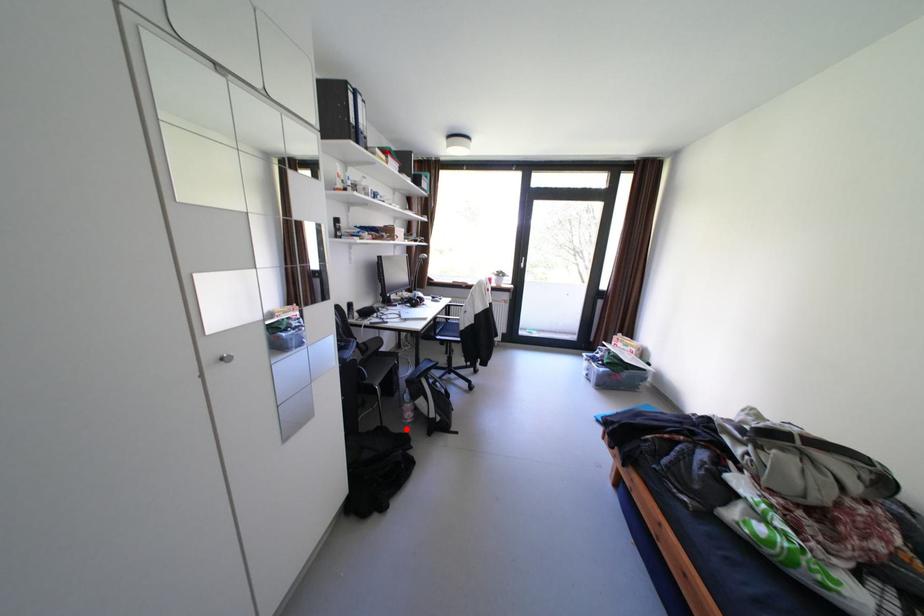
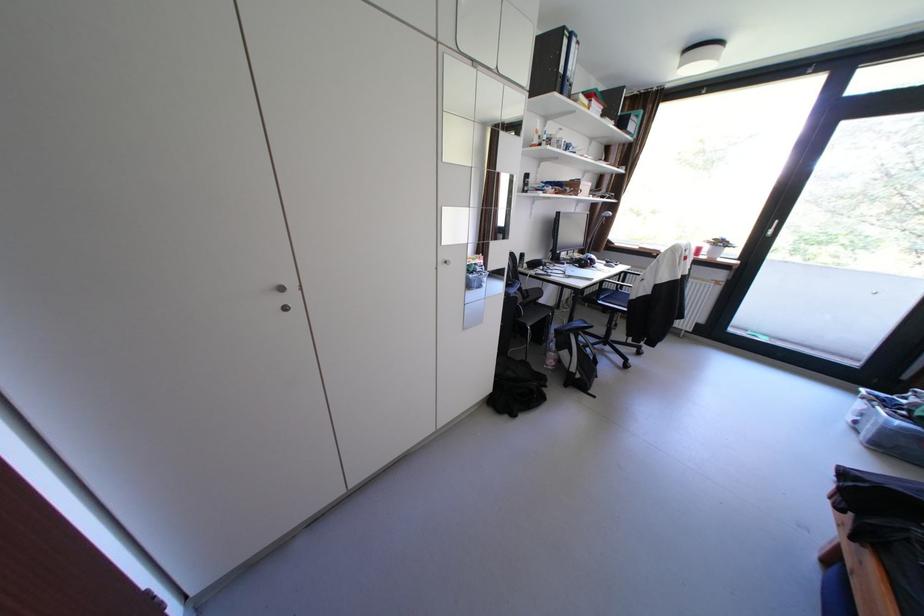
Where in the second image is the point corresponding to the highlighted location from the first image?

(546, 368)